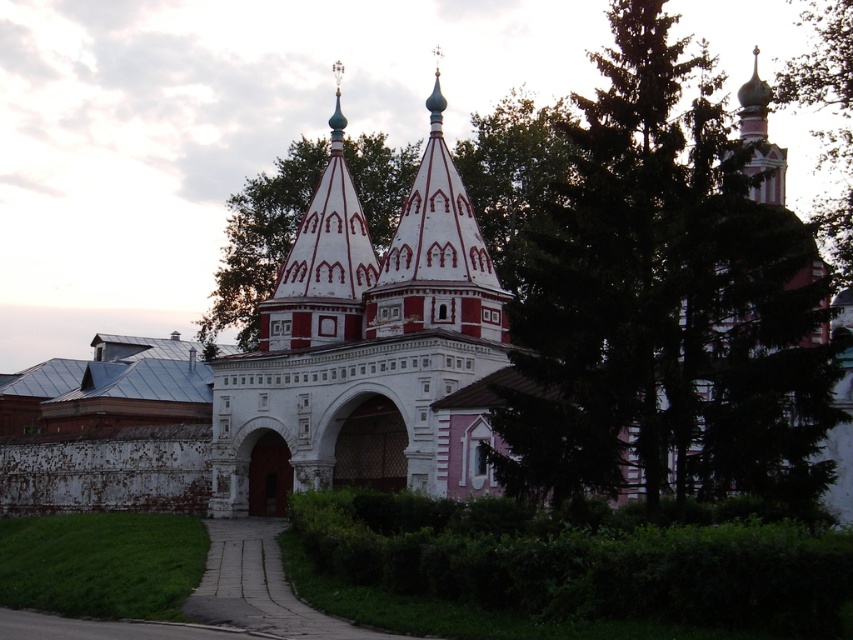
You are a visitor approaching the church and want to know which structure is wider when viewed from the front. Which one is wider between the white stone church at center and the red painted wood spire at center?

The white stone church at center is wider than the red painted wood spire at center according to the description.

You are standing at the entrance of the church and see two points marked on the ground. The first point is at coordinate point (738, 240) and the second point is at coordinate point (404, 259). Which point is closer to you as you face the church?

Point (738, 240) is in front of point (404, 259), so the point closer to you as you face the church is point (738, 240).